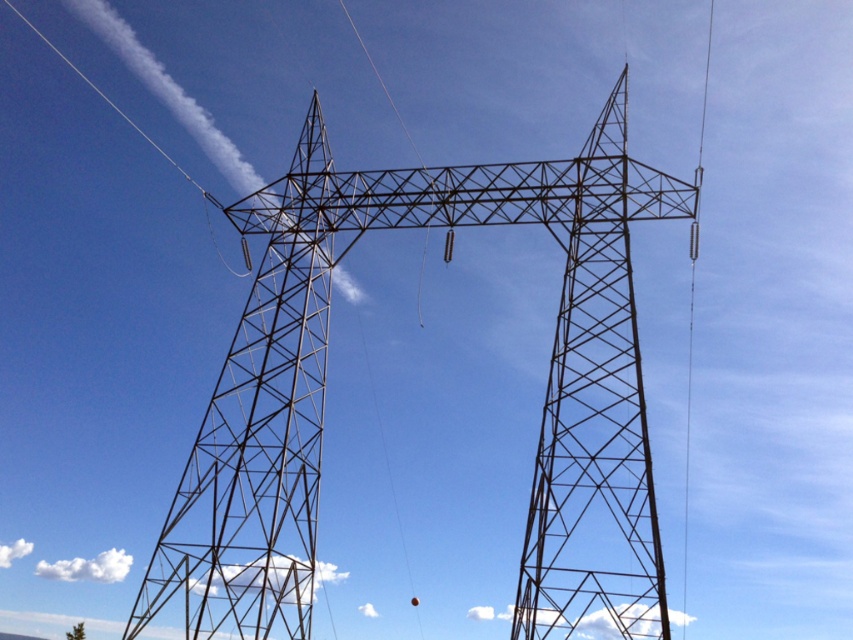
Question: Does metallic structure at left appear on the left side of metallic wire at right?

Choices:
 (A) no
 (B) yes

Answer: (B)

Question: Does metallic structure at left lie in front of metallic wire at right?

Choices:
 (A) yes
 (B) no

Answer: (A)

Question: Which of the following is the farthest from the observer?

Choices:
 (A) (351, 189)
 (B) (285, 492)

Answer: (A)

Question: Which object is positioned farthest from the metallic structure at center?

Choices:
 (A) metallic structure at left
 (B) metallic wire at right

Answer: (B)

Question: In this image, where is metallic structure at left located relative to metallic wire at right?

Choices:
 (A) left
 (B) right

Answer: (A)

Question: Which object is the farthest from the metallic structure at left?

Choices:
 (A) metallic structure at center
 (B) metallic wire at right

Answer: (B)